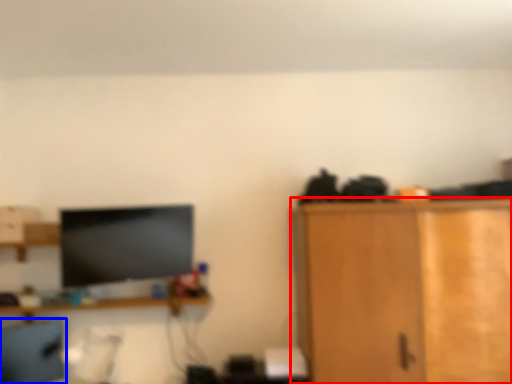
Question: Which object is further to the camera taking this photo, cabinetry (highlighted by a red box) or computer chair (highlighted by a blue box)?

Choices:
 (A) cabinetry
 (B) computer chair

Answer: (B)